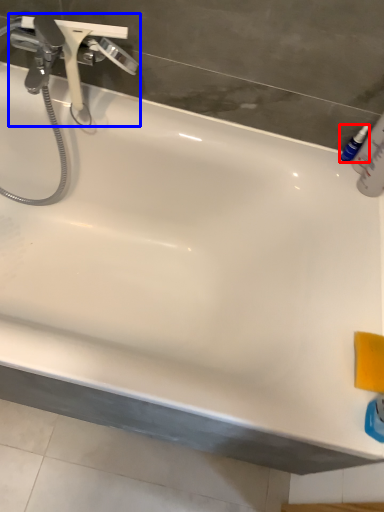
Question: Which of the following is the farthest to the observer, mouthwash (highlighted by a red box) or tap (highlighted by a blue box)?

Choices:
 (A) mouthwash
 (B) tap

Answer: (A)